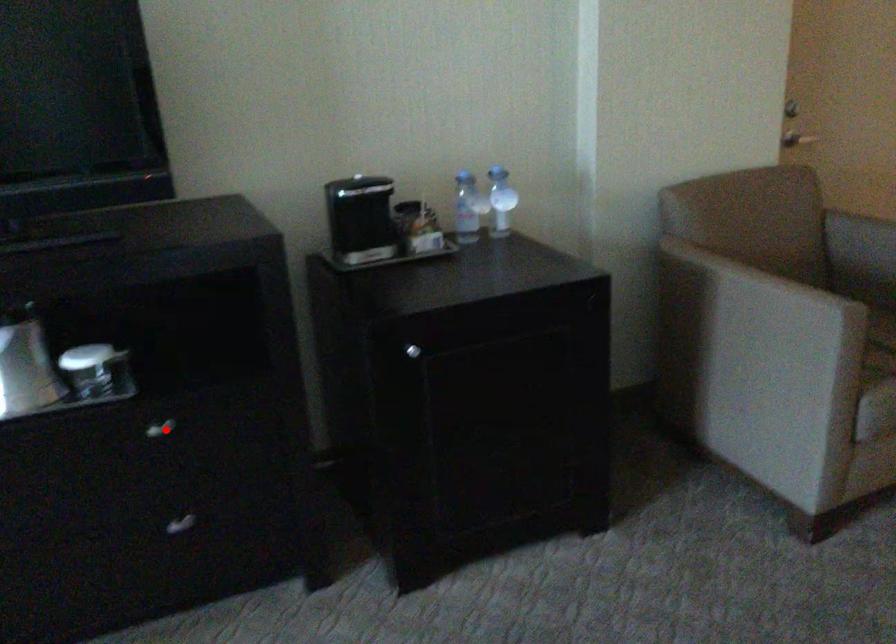
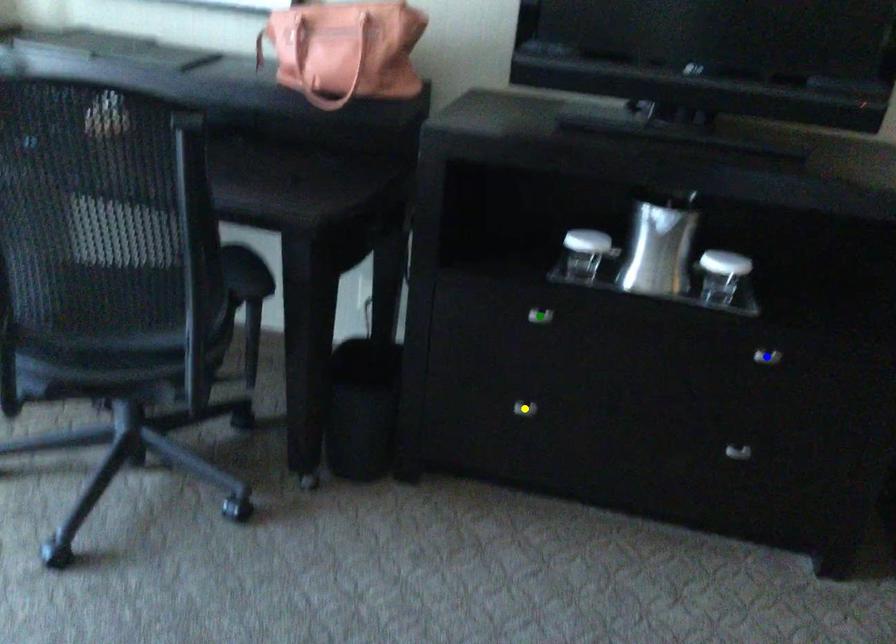
Question: I am providing you with two images of the same scene from different viewpoints. A red point is marked on the first image. You are given multiple points on the second image. In image 2, which mark is for the same physical point as the one in image 1?

Choices:
 (A) yellow point
 (B) blue point
 (C) green point

Answer: (B)